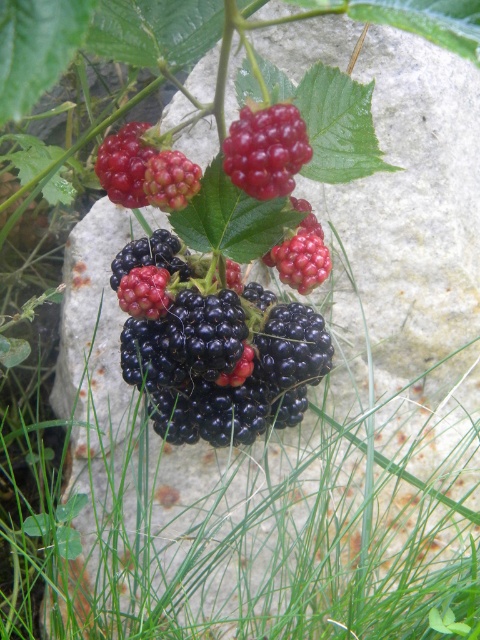
Who is positioned more to the left, shiny black berries at center or shiny red berries at center?

Positioned to the left is shiny black berries at center.

Does shiny black berries at center have a greater width compared to shiny red berries at center?

Yes, shiny black berries at center is wider than shiny red berries at center.

This screenshot has height=640, width=480. What do you see at coordinates (214, 348) in the screenshot?
I see `shiny black berries at center` at bounding box center [214, 348].

At what (x,y) coordinates should I click in order to perform the action: click on shiny black berries at center. Please return your answer as a coordinate pair (x, y). This screenshot has width=480, height=640. Looking at the image, I should click on (214, 348).